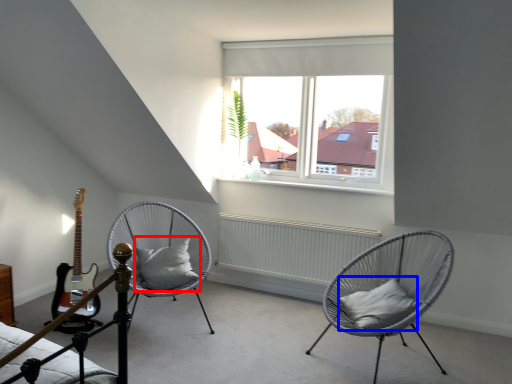
Question: Which object appears closest to the camera in this image, pillow (highlighted by a red box) or pillow (highlighted by a blue box)?

Choices:
 (A) pillow
 (B) pillow

Answer: (B)